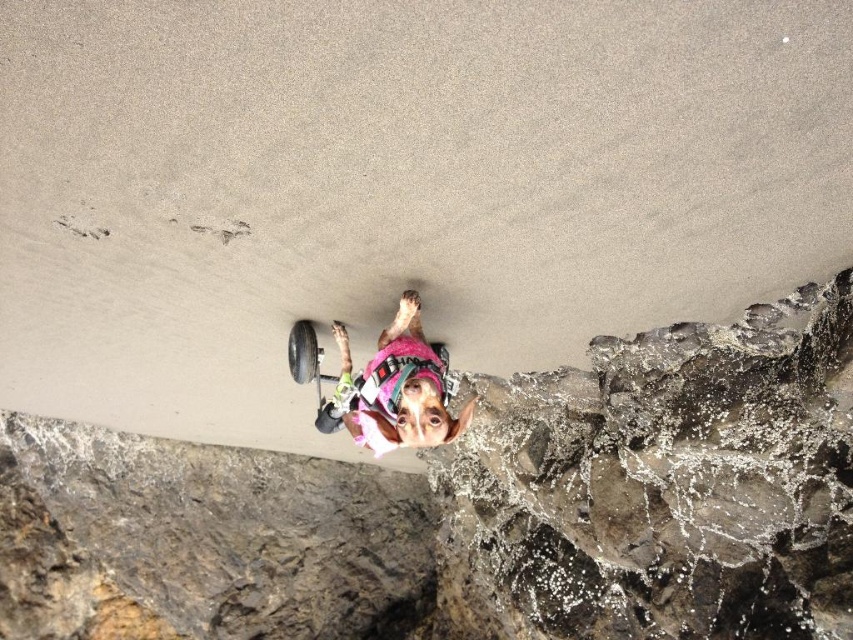
Can you confirm if rough stone wall at lower right is wider than pink fabric dog at center?

Indeed, rough stone wall at lower right has a greater width compared to pink fabric dog at center.

Can you confirm if rough stone wall at lower right is positioned below pink fabric dog at center?

Yes.

Is point (838, 420) behind point (369, 380)?

No, (838, 420) is closer to viewer.

Where is `rough stone wall at lower right`? The height and width of the screenshot is (640, 853). rough stone wall at lower right is located at coordinates (660, 486).